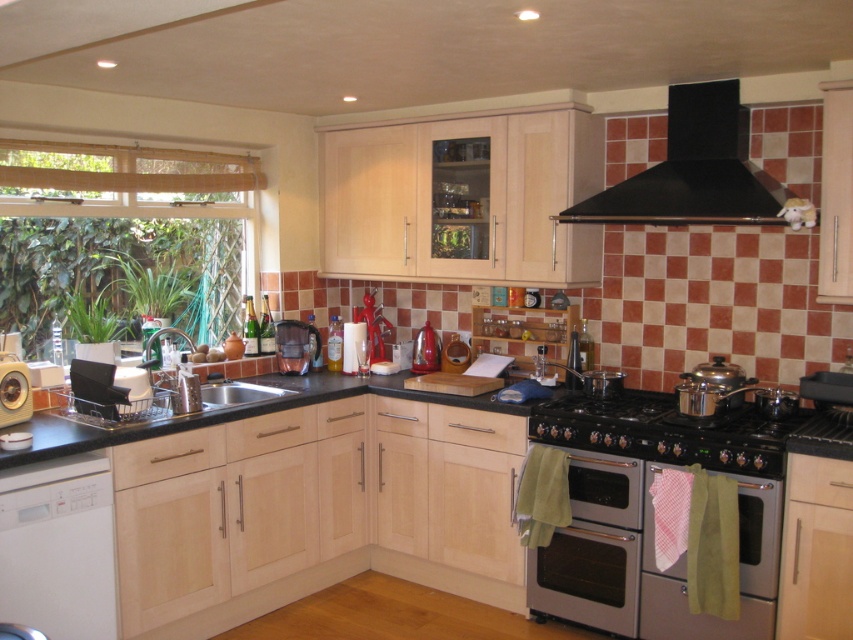
Consider the image. You are a home inspector checking the kitchen layout. You notice the wooden blinds at left and the white matte dishwasher at lower left. Which object is positioned higher in the image?

The wooden blinds at left is above the white matte dishwasher at lower left, so the wooden blinds at left is positioned higher in the image.

Based on the photo, you are a chef preparing to clean the kitchen. You need to wipe the wooden blinds at left and the matte plastic coffee maker at center. Which one should you clean first if you want to start from the highest point?

The wooden blinds at left should be cleaned first because they are located above the matte plastic coffee maker at center, making them the higher object.